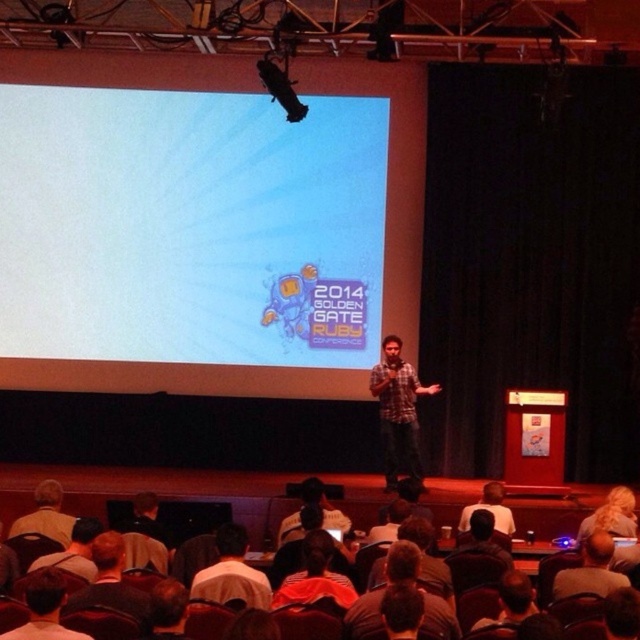
Is point (401, 356) positioned before point (269, 596)?

No, it is not.

Can you confirm if plaid fabric shirt at center is bigger than white shirt at lower center?

Correct, plaid fabric shirt at center is larger in size than white shirt at lower center.

Does point (378, 362) come behind point (212, 564)?

Yes.

Where is `plaid fabric shirt at center`? The image size is (640, 640). plaid fabric shirt at center is located at coordinates (397, 412).

Is white matte projection screen at upper center positioned behind dark brown leather jacket at lower left?

Yes, it is.

Which is more to the right, white matte projection screen at upper center or dark brown leather jacket at lower left?

Positioned to the right is dark brown leather jacket at lower left.

Identify the location of white matte projection screen at upper center. This screenshot has height=640, width=640. (189, 227).

Does white shirt at lower center have a smaller size compared to matte black shirt at center?

Correct, white shirt at lower center occupies less space than matte black shirt at center.

The width and height of the screenshot is (640, 640). Find the location of `white shirt at lower center`. white shirt at lower center is located at coordinates (230, 573).

Which is behind, point (202, 586) or point (305, 499)?

The point (305, 499) is behind.

Locate an element on the screen. white shirt at lower center is located at coordinates (x=230, y=573).